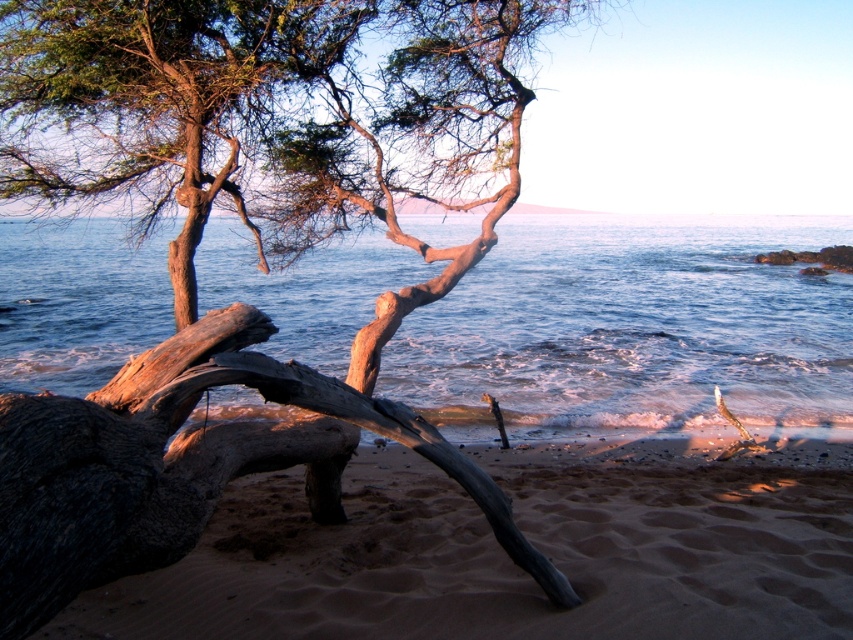
Question: Considering the real-world distances, which object is farthest from the blue water at center?

Choices:
 (A) sandy brown at lower left
 (B) smooth brown driftwood at lower left

Answer: (B)

Question: Which object is farther from the camera taking this photo?

Choices:
 (A) sandy brown at lower left
 (B) smooth brown driftwood at lower left

Answer: (B)

Question: Considering the real-world distances, which object is closest to the blue water at center?

Choices:
 (A) smooth brown driftwood at lower left
 (B) sandy brown at lower left

Answer: (B)

Question: Is blue water at center bigger than sandy brown at lower left?

Choices:
 (A) no
 (B) yes

Answer: (B)

Question: Can you confirm if smooth brown driftwood at lower left is bigger than blue water at center?

Choices:
 (A) yes
 (B) no

Answer: (B)

Question: Does smooth brown driftwood at lower left have a greater width compared to sandy brown at lower left?

Choices:
 (A) yes
 (B) no

Answer: (B)